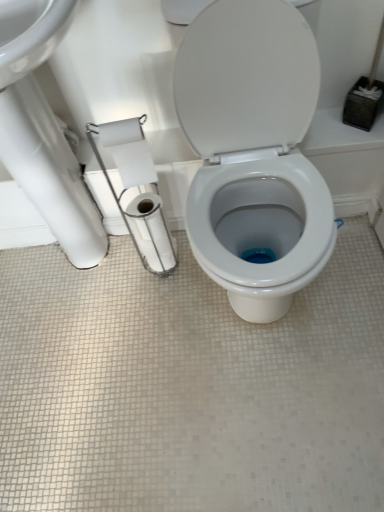
Describe the element at coordinates (253, 145) in the screenshot. I see `white glossy toilet at center` at that location.

Find the location of a particular element. white glossy toilet paper at center, which ranks as the third toilet paper in front-to-back order is located at coordinates (148, 227).

From a real-world perspective, is white matte toilet paper at left, the second toilet paper in the front-to-back sequence, over white paper at left, arranged as the first toilet paper when viewed from the front?

Yes.

Find the location of a particular element. the 1st toilet paper to the right of the white matte toilet paper at left, the second toilet paper in the front-to-back sequence, counting from the anchor's position is located at coordinates (137, 191).

Does white matte toilet paper at left, which is counted as the second toilet paper, starting from the back, appear on the right side of white paper at left, arranged as the first toilet paper when viewed from the front?

No.

Is point (138, 167) positioned after point (131, 135)?

Yes.

Does white glossy sink at upper left appear on the right side of white glossy toilet paper at center, which ranks as the third toilet paper in front-to-back order?

No, white glossy sink at upper left is not to the right of white glossy toilet paper at center, which ranks as the third toilet paper in front-to-back order.

Are white glossy sink at upper left and white glossy toilet paper at center, which ranks as the third toilet paper in front-to-back order, located far from each other?

No, white glossy sink at upper left is in close proximity to white glossy toilet paper at center, which ranks as the third toilet paper in front-to-back order.

From the image's perspective, which is below, white glossy sink at upper left or white glossy toilet paper at center, arranged as the first toilet paper when viewed from the back?

From the image's view, white glossy toilet paper at center, arranged as the first toilet paper when viewed from the back, is below.

From the image's perspective, starting from the white glossy sink at upper left, which toilet paper is the 3rd one below? Please provide its 2D coordinates.

[(148, 227)]

From the image's perspective, would you say white glossy sink at upper left is positioned over white paper at left, arranged as the first toilet paper when viewed from the front?

Yes, from the image's perspective, white glossy sink at upper left is on top of white paper at left, arranged as the first toilet paper when viewed from the front.

Between white glossy sink at upper left and white paper at left, arranged as the third toilet paper when viewed from the back, which one has smaller width?

white paper at left, arranged as the third toilet paper when viewed from the back.

Considering the relative sizes of white glossy sink at upper left and white paper at left, arranged as the first toilet paper when viewed from the front, in the image provided, is white glossy sink at upper left bigger than white paper at left, arranged as the first toilet paper when viewed from the front,?

Yes, white glossy sink at upper left is bigger than white paper at left, arranged as the first toilet paper when viewed from the front.

Looking at this image, are white glossy sink at upper left and white matte toilet paper at left, the second toilet paper in the front-to-back sequence, beside each other?

No, white glossy sink at upper left is not beside white matte toilet paper at left, the second toilet paper in the front-to-back sequence.

Identify the location of toilet paper located above the white glossy sink at upper left (from a real-world perspective). The width and height of the screenshot is (384, 512). (129, 150).

Based on the photo, measure the distance between white glossy sink at upper left and white matte toilet paper at left, the second toilet paper in the front-to-back sequence.

white glossy sink at upper left is 9.41 inches away from white matte toilet paper at left, the second toilet paper in the front-to-back sequence.

Considering the relative sizes of white glossy sink at upper left and white matte toilet paper at left, which is counted as the second toilet paper, starting from the back, in the image provided, is white glossy sink at upper left shorter than white matte toilet paper at left, which is counted as the second toilet paper, starting from the back,?

No, white glossy sink at upper left is not shorter than white matte toilet paper at left, which is counted as the second toilet paper, starting from the back.

Between white glossy toilet at center and white glossy toilet paper at center, which ranks as the third toilet paper in front-to-back order, which one is positioned behind?

white glossy toilet paper at center, which ranks as the third toilet paper in front-to-back order, is more distant.

From a real-world perspective, is white glossy toilet at center located beneath white glossy toilet paper at center, which ranks as the third toilet paper in front-to-back order?

No.

Which is in front, point (248, 108) or point (154, 229)?

The point (248, 108) is more forward.

From the image's perspective, would you say white glossy toilet at center is shown under white glossy toilet paper at center, arranged as the first toilet paper when viewed from the back?

Incorrect, from the image's perspective, white glossy toilet at center is higher than white glossy toilet paper at center, arranged as the first toilet paper when viewed from the back.

Does white glossy sink at upper left appear on the right side of white glossy toilet at center?

In fact, white glossy sink at upper left is to the left of white glossy toilet at center.

Considering the positions of objects white glossy sink at upper left and white glossy toilet at center in the image provided, who is behind, white glossy sink at upper left or white glossy toilet at center?

white glossy sink at upper left is more distant.

Is point (37, 191) positioned behind point (234, 144)?

Yes.

From the image's perspective, is white glossy sink at upper left located above or below white glossy toilet at center?

From the image's perspective, white glossy sink at upper left appears above white glossy toilet at center.

Can you confirm if white paper at left, arranged as the third toilet paper when viewed from the back, is taller than white glossy sink at upper left?

No.

Considering the points (128, 141) and (88, 213), which point is in front, point (128, 141) or point (88, 213)?

The point (128, 141) is more forward.

Is white paper at left, arranged as the first toilet paper when viewed from the front, further to camera compared to white glossy sink at upper left?

That is True.

I want to click on the 1st toilet paper below the white matte toilet paper at left, which is counted as the second toilet paper, starting from the back (from a real-world perspective), so pyautogui.click(x=137, y=191).

This screenshot has width=384, height=512. Identify the location of sink above the white glossy toilet paper at center, arranged as the first toilet paper when viewed from the back (from a real-world perspective). (43, 129).

Based on their spatial positions, is white glossy toilet at center or white glossy sink at upper left further from white paper at left, arranged as the third toilet paper when viewed from the back?

Based on the image, white glossy toilet at center appears to be further to white paper at left, arranged as the third toilet paper when viewed from the back.

When comparing their distances from white glossy toilet paper at center, which ranks as the third toilet paper in front-to-back order, does white glossy sink at upper left or white matte toilet paper at left, the second toilet paper in the front-to-back sequence, seem closer?

white matte toilet paper at left, the second toilet paper in the front-to-back sequence, lies closer to white glossy toilet paper at center, which ranks as the third toilet paper in front-to-back order, than the other object.

When comparing their distances from white matte toilet paper at left, the second toilet paper in the front-to-back sequence, does white paper at left, arranged as the third toilet paper when viewed from the back, or white glossy toilet paper at center, arranged as the first toilet paper when viewed from the back, seem further?

Among the two, white glossy toilet paper at center, arranged as the first toilet paper when viewed from the back, is located further to white matte toilet paper at left, the second toilet paper in the front-to-back sequence.

Based on their spatial positions, is white glossy sink at upper left or white glossy toilet paper at center, arranged as the first toilet paper when viewed from the back, further from white matte toilet paper at left, which is counted as the second toilet paper, starting from the back?

white glossy sink at upper left.

Which object lies further to the anchor point white glossy toilet paper at center, arranged as the first toilet paper when viewed from the back, white matte toilet paper at left, which is counted as the second toilet paper, starting from the back, or white glossy sink at upper left?

white glossy sink at upper left is positioned further to the anchor white glossy toilet paper at center, arranged as the first toilet paper when viewed from the back.

Estimate the real-world distances between objects in this image. Which object is closer to white paper at left, arranged as the first toilet paper when viewed from the front, white matte toilet paper at left, which is counted as the second toilet paper, starting from the back, or white glossy toilet paper at center, which ranks as the third toilet paper in front-to-back order?

white glossy toilet paper at center, which ranks as the third toilet paper in front-to-back order, lies closer to white paper at left, arranged as the first toilet paper when viewed from the front, than the other object.

Looking at the image, which one is located closer to white glossy toilet at center, white matte toilet paper at left, the second toilet paper in the front-to-back sequence, or white glossy sink at upper left?

white matte toilet paper at left, the second toilet paper in the front-to-back sequence.

Considering their positions, is white glossy toilet paper at center, arranged as the first toilet paper when viewed from the back, positioned further to white glossy toilet at center than white glossy sink at upper left?

white glossy sink at upper left lies further to white glossy toilet at center than the other object.

You are a GUI agent. You are given a task and a screenshot of the screen. Output one action in this format:
    pyautogui.click(x=<x>, y=<y>)
    Task: Click on the toilet paper between white paper at left, arranged as the third toilet paper when viewed from the back, and white glossy toilet paper at center, which ranks as the third toilet paper in front-to-back order, along the z-axis
    Image resolution: width=384 pixels, height=512 pixels.
    Given the screenshot: What is the action you would take?
    [x=129, y=150]

This screenshot has width=384, height=512. Find the location of `toilet paper positioned between white glossy toilet at center and white matte toilet paper at left, which is counted as the second toilet paper, starting from the back, from near to far`. toilet paper positioned between white glossy toilet at center and white matte toilet paper at left, which is counted as the second toilet paper, starting from the back, from near to far is located at coordinates (137, 191).

Image resolution: width=384 pixels, height=512 pixels. I want to click on sink positioned between white glossy toilet at center and white glossy toilet paper at center, arranged as the first toilet paper when viewed from the back, from near to far, so click(43, 129).

The width and height of the screenshot is (384, 512). In order to click on toilet paper located between white glossy sink at upper left and white matte toilet paper at left, which is counted as the second toilet paper, starting from the back, in the depth direction in this screenshot , I will do [x=137, y=191].